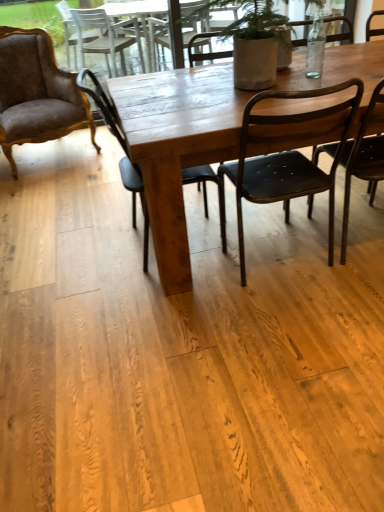
At what (x,y) coordinates should I click in order to perform the action: click on free space between matte black chair at center, the 3th chair viewed from the right, and wooden table at center. Please return your answer as a coordinate pair (x, y). Looking at the image, I should click on (136, 275).